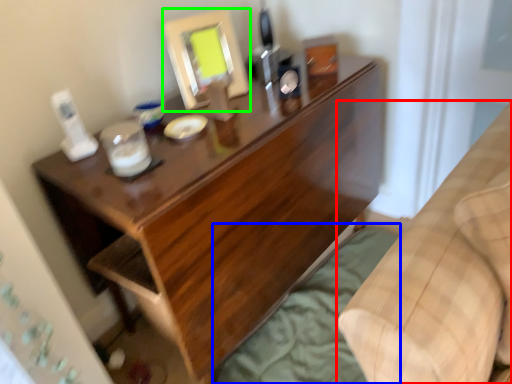
Question: Based on their relative distances, which object is farther from furniture (highlighted by a red box)? Choose from sheet (highlighted by a blue box) and mirror (highlighted by a green box).

Choices:
 (A) sheet
 (B) mirror

Answer: (B)